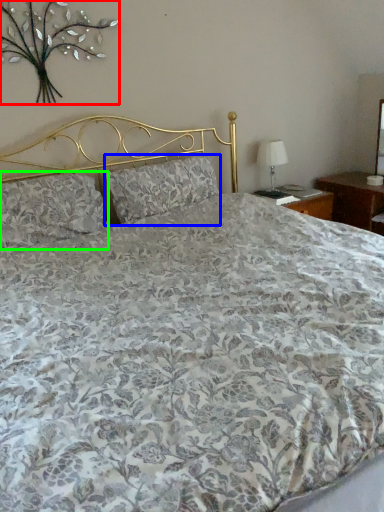
Question: Which object is the farthest from floral arrangement (highlighted by a red box)? Choose among these: pillow (highlighted by a blue box) or pillow (highlighted by a green box).

Choices:
 (A) pillow
 (B) pillow

Answer: (A)